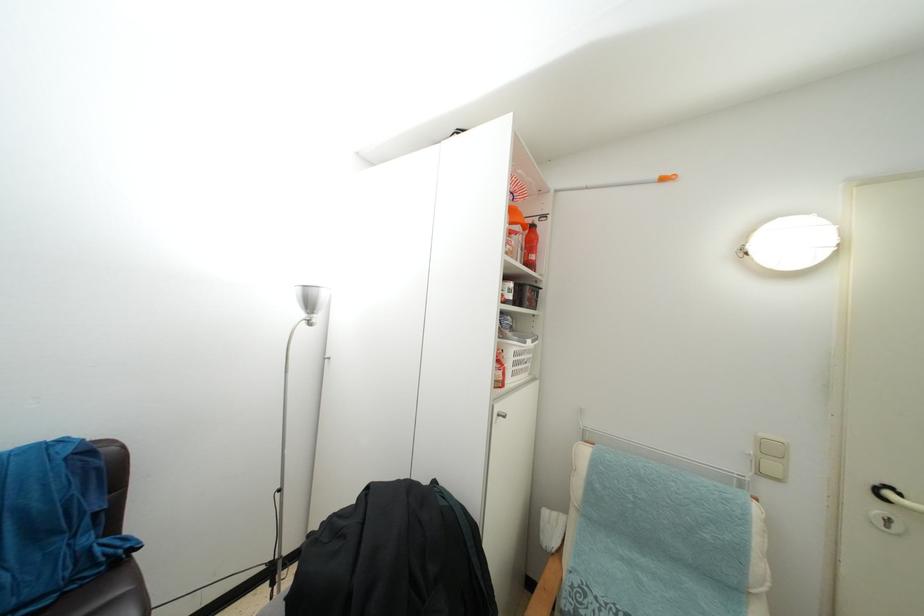
Locate an element on the screen. The image size is (924, 616). silver lamp head is located at coordinates (311, 298).